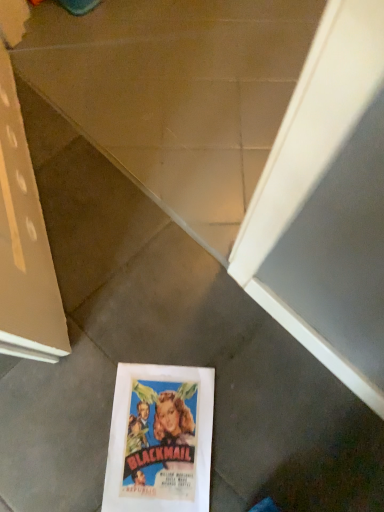
Locate an element on the screen. Image resolution: width=384 pixels, height=512 pixels. free space above colorful paper poster at lower center (from a real-world perspective) is located at coordinates (158, 442).